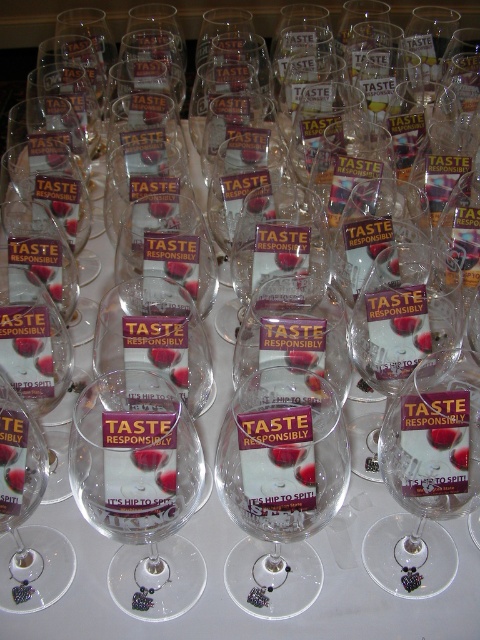
Does clear glass wine glass at center lie behind clear glass wine at center?

No, it is in front of clear glass wine at center.

What do you see at coordinates (140, 490) in the screenshot? This screenshot has width=480, height=640. I see `clear glass wine glass at center` at bounding box center [140, 490].

You are a GUI agent. You are given a task and a screenshot of the screen. Output one action in this format:
    pyautogui.click(x=<x>, y=<y>)
    Task: Click on the clear glass wine glass at center
    This screenshot has width=480, height=640.
    Given the screenshot: What is the action you would take?
    pyautogui.click(x=140, y=490)

How far apart are matte glass at center and transparent glass at center?

They are 12.05 inches apart.

How far apart are matte glass at center and transparent glass at center?

matte glass at center is 30.61 centimeters away from transparent glass at center.

Is point (146, 452) more distant than point (448, 440)?

That is False.

Identify the location of matte glass at center. Image resolution: width=480 pixels, height=640 pixels. (148, 458).

Does transparent glass at center appear on the left side of clear glass wine at center?

Incorrect, transparent glass at center is not on the left side of clear glass wine at center.

Looking at this image, can you confirm if transparent glass at center is positioned to the right of clear glass wine at center?

Indeed, transparent glass at center is positioned on the right side of clear glass wine at center.

Between point (437, 429) and point (152, 202), which one is positioned in front?

Point (437, 429) is more forward.

This screenshot has width=480, height=640. Identify the location of transparent glass at center. (443, 436).